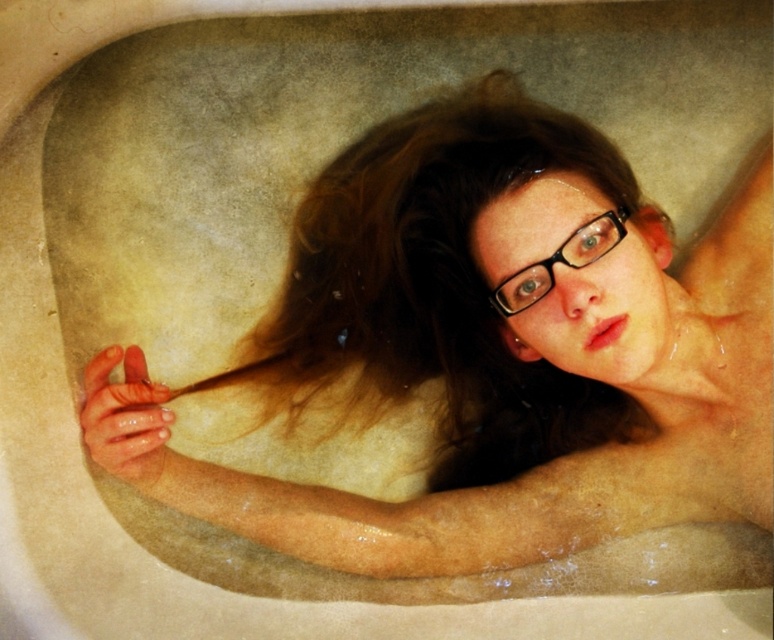
Who is positioned more to the left, smooth skin girl at center or black plastic glasses at center?

Positioned to the left is smooth skin girl at center.

Can you confirm if smooth skin girl at center is taller than black plastic glasses at center?

Correct, smooth skin girl at center is much taller as black plastic glasses at center.

This screenshot has height=640, width=774. Describe the element at coordinates (492, 352) in the screenshot. I see `smooth skin girl at center` at that location.

At what (x,y) coordinates should I click in order to perform the action: click on smooth skin girl at center. Please return your answer as a coordinate pair (x, y). Looking at the image, I should click on (492, 352).